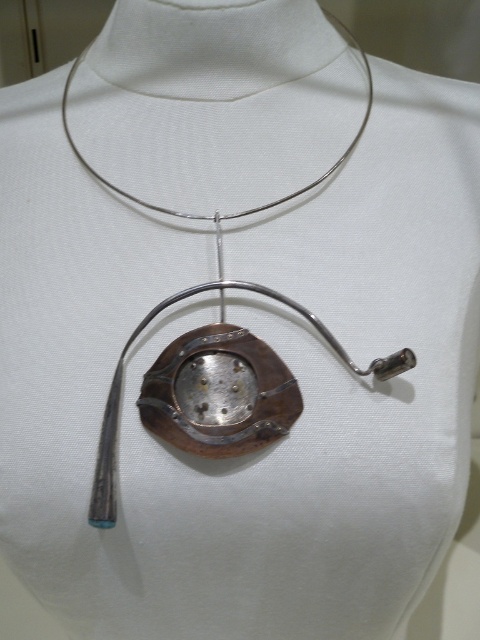
Between rusty metal pendant at center and polished silver pendant at center, which one is positioned higher?

polished silver pendant at center is above.

Does rusty metal pendant at center appear over polished silver pendant at center?

Actually, rusty metal pendant at center is below polished silver pendant at center.

Does point (175, 413) lie in front of point (122, 348)?

That is True.

The height and width of the screenshot is (640, 480). Find the location of `rusty metal pendant at center`. rusty metal pendant at center is located at coordinates (218, 394).